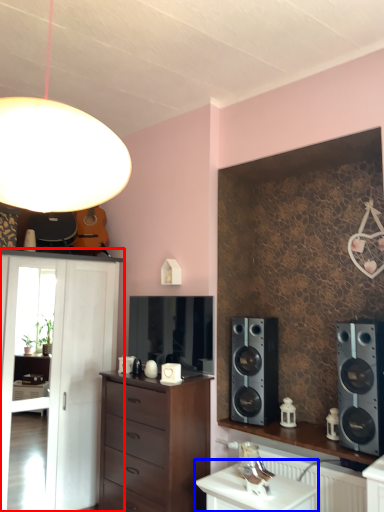
Question: Which of the following is the closest to the observer, shelf (highlighted by a red box) or table (highlighted by a blue box)?

Choices:
 (A) shelf
 (B) table

Answer: (B)